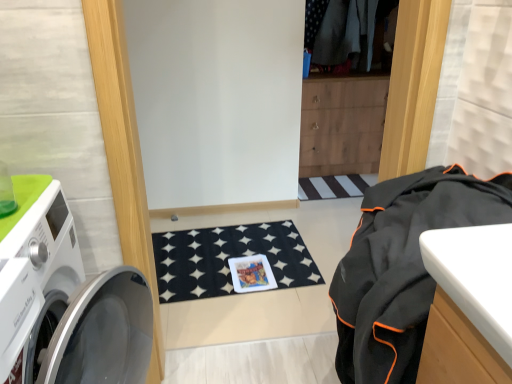
Question: Based on their positions, is black mesh bag at right located to the left or right of white glossy washing machine at left?

Choices:
 (A) right
 (B) left

Answer: (A)

Question: Is point (370, 354) positioned closer to the camera than point (29, 314)?

Choices:
 (A) closer
 (B) farther

Answer: (B)

Question: From the image's perspective, is black mesh bag at right above or below white glossy washing machine at left?

Choices:
 (A) below
 (B) above

Answer: (B)

Question: Is white glossy washing machine at left to the left or to the right of black mesh bag at right in the image?

Choices:
 (A) left
 (B) right

Answer: (A)

Question: Is point (58, 375) closer or farther from the camera than point (370, 283)?

Choices:
 (A) closer
 (B) farther

Answer: (B)

Question: Is white glossy washing machine at left in front of or behind black mesh bag at right in the image?

Choices:
 (A) behind
 (B) front

Answer: (B)

Question: In terms of height, does white glossy washing machine at left look taller or shorter compared to black mesh bag at right?

Choices:
 (A) tall
 (B) short

Answer: (A)